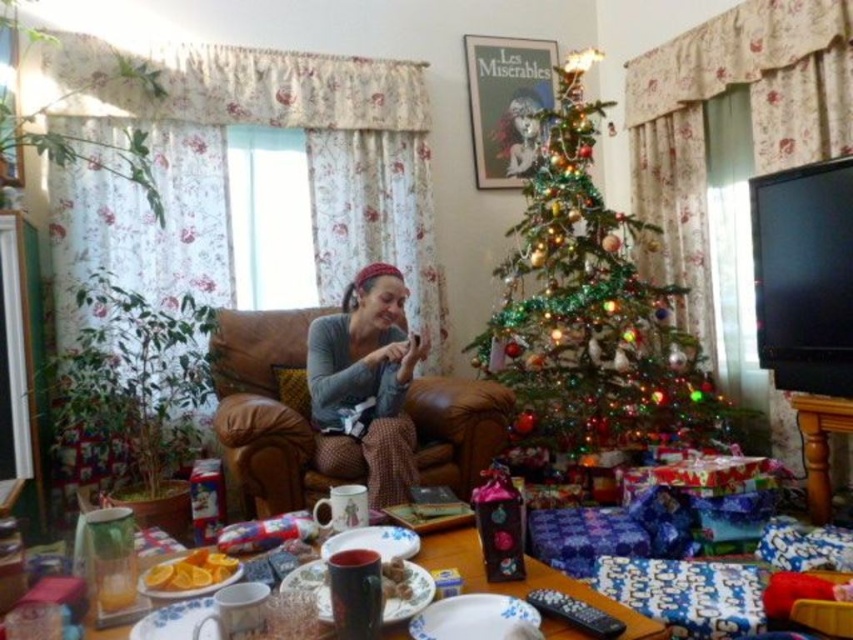
You are a delivery person who needs to place a new package on the table. The package is 12 inches wide. Can you fit it between the green shiny christmas tree at center and the gray knitted sweater at center?

The green shiny christmas tree at center and gray knitted sweater at center are 36.92 inches apart from each other. Since the package is only 12 inches wide, there is enough space to fit it between them.